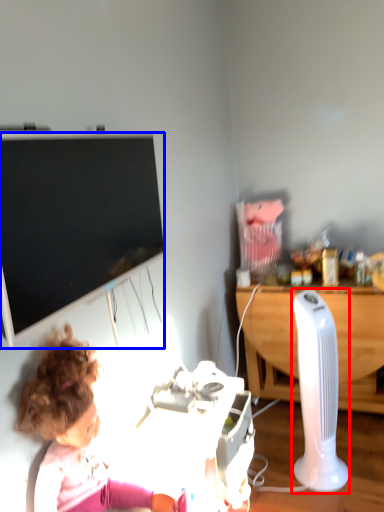
Question: Which of the following is the closest to the observer, equipment (highlighted by a red box) or television (highlighted by a blue box)?

Choices:
 (A) equipment
 (B) television

Answer: (B)